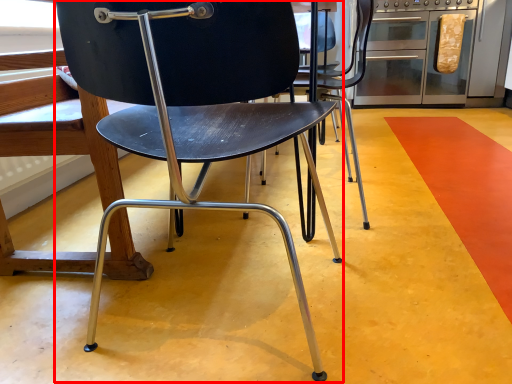
Question: From the image's perspective, what is the correct spatial relationship of chair (annotated by the red box) in relation to oven?

Choices:
 (A) below
 (B) above

Answer: (A)